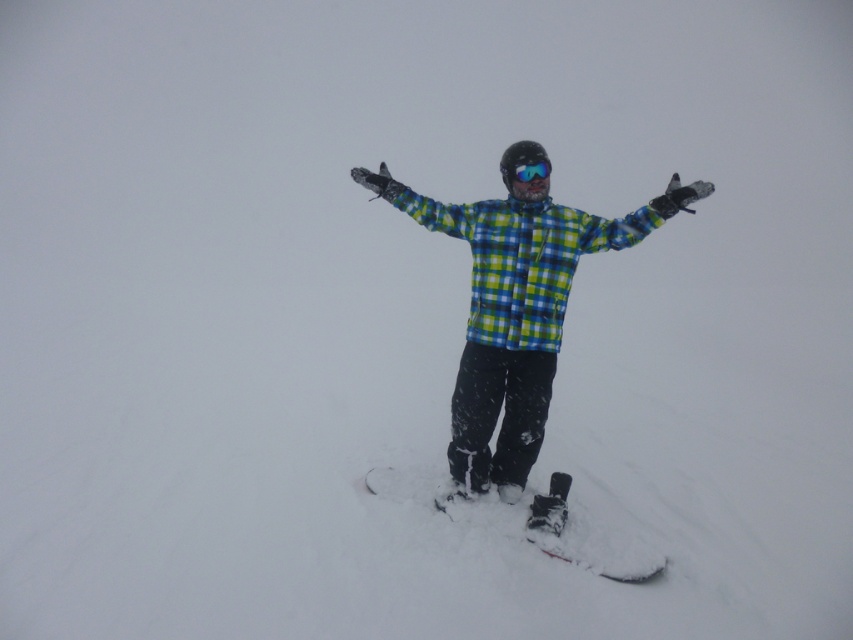
Question: Which point is closer to the camera?

Choices:
 (A) (450, 458)
 (B) (538, 545)

Answer: (B)

Question: Does black matte snowboard at center appear on the left side of blue reflective lens goggles at center?

Choices:
 (A) yes
 (B) no

Answer: (A)

Question: Which point appears closest to the camera in this image?

Choices:
 (A) (476, 472)
 (B) (538, 172)
 (C) (614, 560)

Answer: (C)

Question: Does black matte snowboard at center have a larger size compared to blue reflective lens goggles at center?

Choices:
 (A) yes
 (B) no

Answer: (A)

Question: Is checkered fabric snowboarder at center smaller than black matte snowboard at center?

Choices:
 (A) no
 (B) yes

Answer: (A)

Question: Which of the following is the farthest from the observer?

Choices:
 (A) (514, 216)
 (B) (525, 177)
 (C) (526, 518)

Answer: (C)